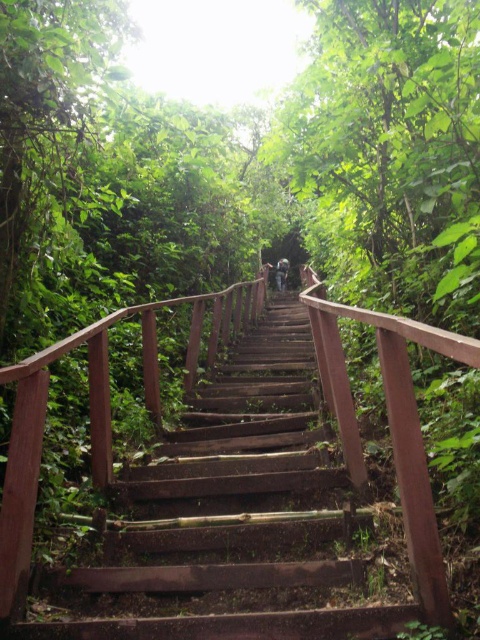
Which is above, wooden stairs at center or light brown wooden stairs at center?

light brown wooden stairs at center is higher up.

Who is positioned more to the right, wooden stairs at center or light brown wooden stairs at center?

light brown wooden stairs at center is more to the right.

I want to click on wooden stairs at center, so click(x=230, y=518).